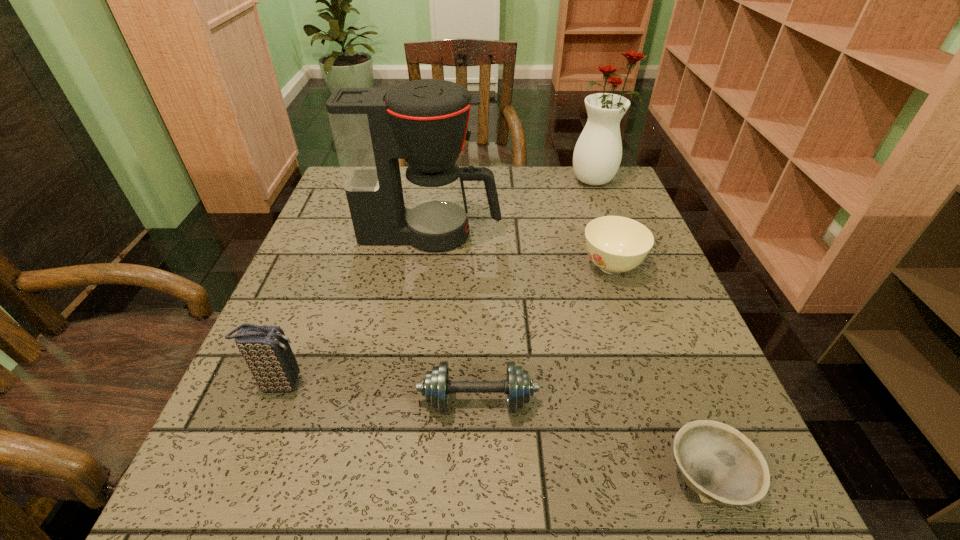
I want to click on free space between the vase and the bowl, so click(652, 329).

Find the location of a particular element. Image resolution: width=960 pixels, height=540 pixels. vacant region between the coffee maker and the nearest object is located at coordinates (568, 356).

Identify the location of vacant space that is in between the clutch bag and the vase. The height and width of the screenshot is (540, 960). click(438, 282).

You are a GUI agent. You are given a task and a screenshot of the screen. Output one action in this format:
    pyautogui.click(x=<x>, y=<y>)
    Task: Click on the vacant region between the coffee maker and the dumbbell
    The width and height of the screenshot is (960, 540).
    Given the screenshot: What is the action you would take?
    pyautogui.click(x=454, y=318)

This screenshot has width=960, height=540. I want to click on free space between the dumbbell and the third tallest object, so click(x=378, y=393).

At what (x,y) coordinates should I click in order to perform the action: click on unoccupied position between the dumbbell and the farthest object. Please return your answer as a coordinate pair (x, y). Image resolution: width=960 pixels, height=540 pixels. Looking at the image, I should click on (538, 291).

Identify the location of empty location between the nearest object and the dumbbell. The height and width of the screenshot is (540, 960). (592, 440).

The height and width of the screenshot is (540, 960). Find the location of `vacant area between the coffee maker and the nearest object`. vacant area between the coffee maker and the nearest object is located at coordinates (568, 356).

Point out which object is positioned as the third nearest to the vase. Please provide its 2D coordinates. Your answer should be formatted as a tuple, i.e. [(x, y)], where the tuple contains the x and y coordinates of a point satisfying the conditions above.

[(436, 386)]

This screenshot has width=960, height=540. Identify the location of object that can be found as the fifth closest to the coffee maker. (721, 465).